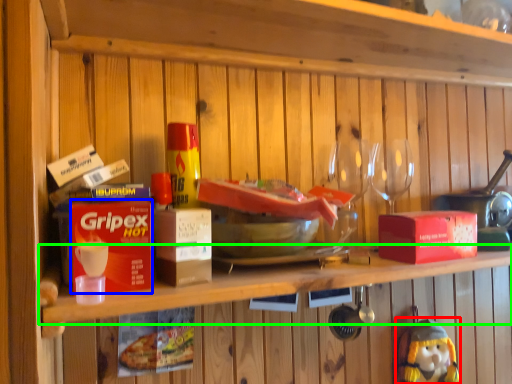
Question: Which object is positioned farthest from figurine (highlighted by a red box)? Select from box (highlighted by a blue box) and shelf (highlighted by a green box).

Choices:
 (A) box
 (B) shelf

Answer: (A)